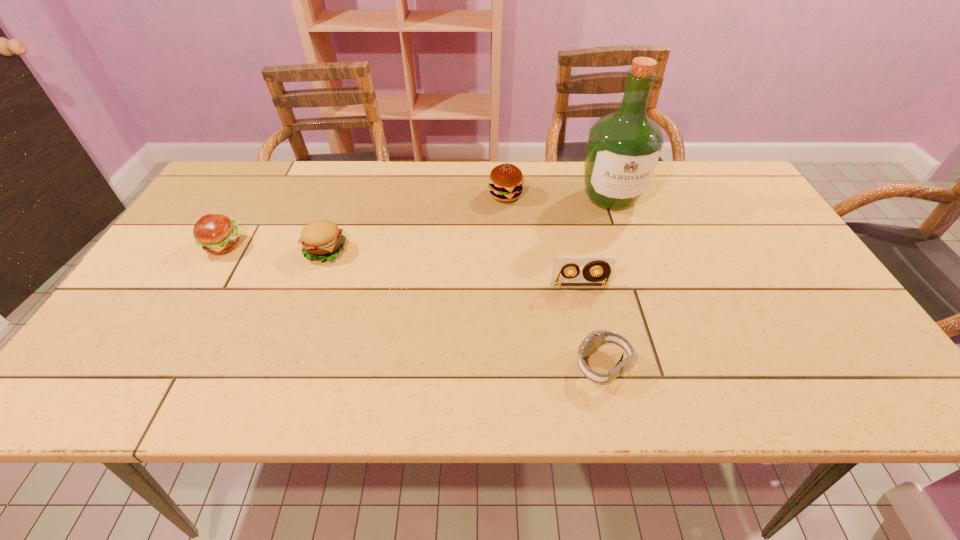
Where is `vacant point at the near edge`? The width and height of the screenshot is (960, 540). vacant point at the near edge is located at coordinates click(x=293, y=399).

This screenshot has height=540, width=960. What are the coordinates of `vacant space at the left edge of the desktop` in the screenshot? It's located at (171, 275).

Where is `vacant area at the right edge`? The image size is (960, 540). vacant area at the right edge is located at coordinates (785, 284).

The height and width of the screenshot is (540, 960). In order to click on empty space between the leftmost hamburger and the videotape in this screenshot , I will do `click(401, 265)`.

Where is `free space between the leftmost hamburger and the nearest object`? free space between the leftmost hamburger and the nearest object is located at coordinates (413, 306).

Where is `vacant area that lies between the second nearest object and the rightmost hamburger`? Image resolution: width=960 pixels, height=540 pixels. vacant area that lies between the second nearest object and the rightmost hamburger is located at coordinates (542, 240).

Image resolution: width=960 pixels, height=540 pixels. In order to click on vacant area that lies between the videotape and the tallest object in this screenshot , I will do `click(595, 241)`.

In order to click on vacant area between the leftmost hamburger and the fourth object from right to left in this screenshot , I will do `click(364, 220)`.

The width and height of the screenshot is (960, 540). What are the coordinates of `free space between the second hamburger from left to right and the liquor` in the screenshot? It's located at (468, 224).

This screenshot has height=540, width=960. Identify the location of vacant space that's between the liquor and the leftmost object. (417, 222).